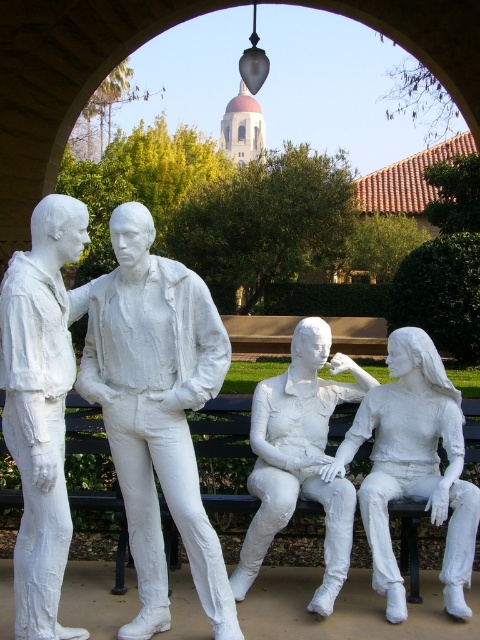
Question: Estimate the real-world distances between objects in this image. Which object is farther from the white plaster figure at center?

Choices:
 (A) white matte statue at center
 (B) white plaster figure at left
 (C) white plaster statue at left

Answer: (B)

Question: From the image, what is the correct spatial relationship of white plaster statue at left in relation to white matte statue at center?

Choices:
 (A) left
 (B) right

Answer: (A)

Question: Which object appears farthest from the camera in this image?

Choices:
 (A) white plaster figure at center
 (B) white plaster figure at left

Answer: (A)

Question: Does white matte statue at center have a lesser width compared to black painted wood bench at center?

Choices:
 (A) no
 (B) yes

Answer: (A)

Question: Is white plaster figure at center bigger than black painted wood bench at center?

Choices:
 (A) no
 (B) yes

Answer: (B)

Question: Based on their relative distances, which object is farther from the white plaster statue at left?

Choices:
 (A) white matte statue at center
 (B) white plaster figure at center

Answer: (A)